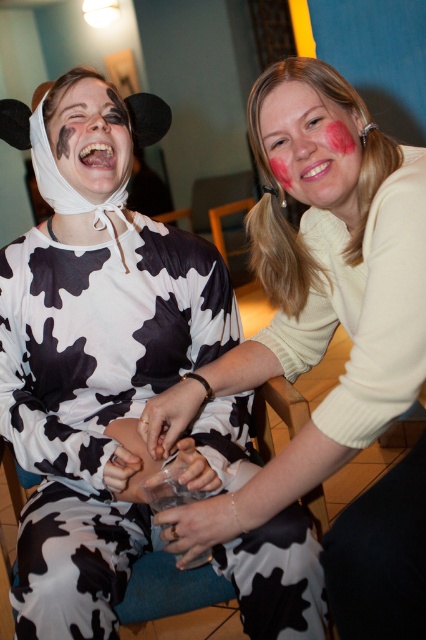
You are a photographer holding a camera. You want to take a photo of the matte white sweater at center without moving the camera. Is it possible to capture the entire sweater in the frame?

The matte white sweater at center and camera are 30.98 inches apart from each other. Since the camera can focus on objects at that distance, it is possible to capture the entire sweater in the frame without moving the camera.

From the picture: You are a photographer setting up a shoot in this scene. You need to ensure that the matte white sweater at center and the black matte paint at upper left are both visible in the frame. Based on their positions, which object is closer to the camera?

The matte white sweater at center is closer to the camera because it is in front of the black matte paint at upper left.

You are organizing a costume party and need to decide whether to place a decorative stand between the matte white sweater at center and the pink matte face paint at upper center. The stand requires 20 cm of vertical space. Can the space between them accommodate the stand?

The matte white sweater at center is taller than the pink matte face paint at upper center, so the vertical space between them may vary depending on their exact positions. However, since the sweater is taller, there might be sufficient vertical space to place the decorative stand requiring 20 cm.